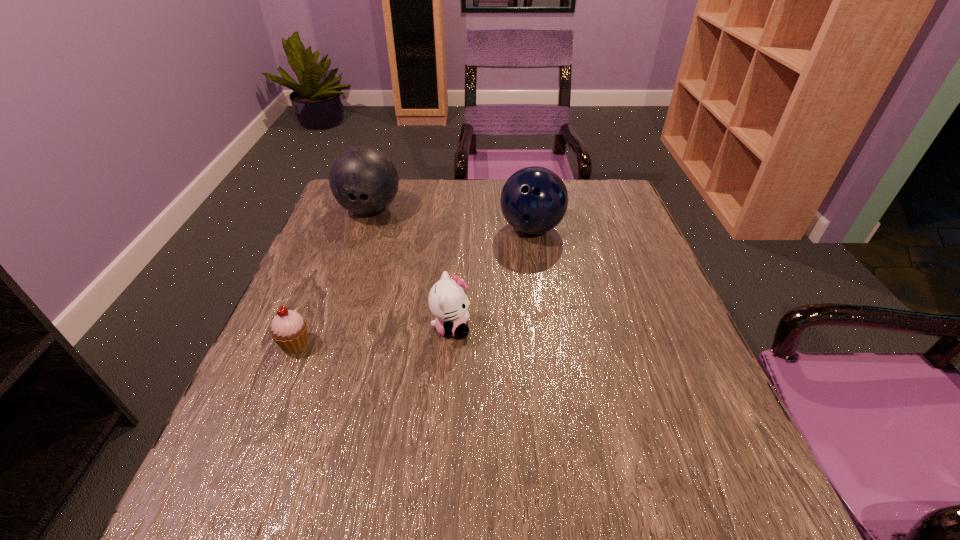
This screenshot has width=960, height=540. Find the location of `the left bowling ball`. the left bowling ball is located at coordinates (363, 180).

You are a GUI agent. You are given a task and a screenshot of the screen. Output one action in this format:
    pyautogui.click(x=<x>, y=<y>)
    Task: Click on the right bowling ball
    The height and width of the screenshot is (540, 960).
    Given the screenshot: What is the action you would take?
    pyautogui.click(x=534, y=200)

Where is `kitten`? The height and width of the screenshot is (540, 960). kitten is located at coordinates (448, 302).

I want to click on the third object from left to right, so click(448, 302).

At what (x,y) coordinates should I click in order to perform the action: click on the shortest object. Please return your answer as a coordinate pair (x, y). Looking at the image, I should click on (288, 329).

In order to click on free region located 0.170m on the grip area of the left bowling ball in this screenshot , I will do `click(348, 271)`.

Where is `free space located on the surface of the rightmost object near the finger holes`? free space located on the surface of the rightmost object near the finger holes is located at coordinates pyautogui.click(x=553, y=368).

Where is `vacant space positioned 0.190m on the front-facing side of the second shortest object`? vacant space positioned 0.190m on the front-facing side of the second shortest object is located at coordinates click(566, 328).

Image resolution: width=960 pixels, height=540 pixels. I want to click on blank space located on the right of the shortest object, so click(448, 344).

I want to click on bowling ball that is at the left edge, so click(x=363, y=180).